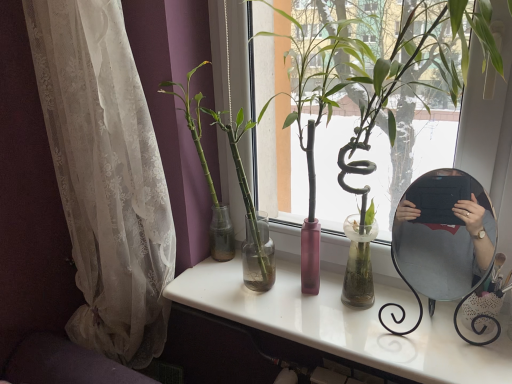
What are the coordinates of `vacant region below green glass vase at center, which is the 1th houseplant in left-to-right order (from a real-world perspective)` in the screenshot? It's located at (236, 288).